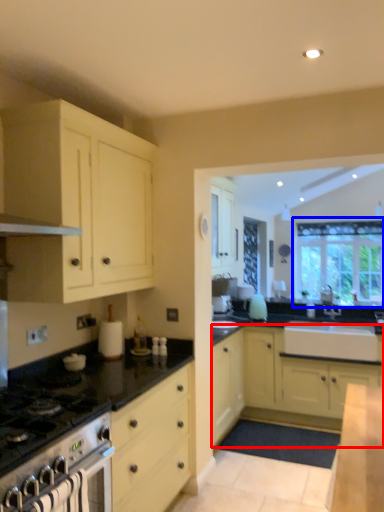
Question: Which object appears farthest to the camera in this image, cabinetry (highlighted by a red box) or window (highlighted by a blue box)?

Choices:
 (A) cabinetry
 (B) window

Answer: (B)